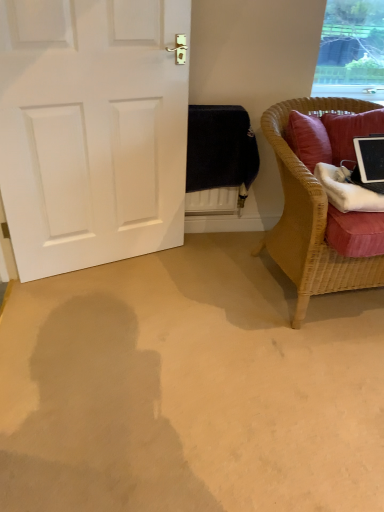
This screenshot has height=512, width=384. I want to click on woven wicker chair at right, so click(x=310, y=217).

The width and height of the screenshot is (384, 512). Describe the element at coordinates (91, 130) in the screenshot. I see `white matte door at left` at that location.

What are the coordinates of `transparent glass window at upper right` in the screenshot? It's located at (351, 51).

How distant is transparent glass window at upper right from black glossy tablet at right?

transparent glass window at upper right and black glossy tablet at right are 3.73 feet apart.

Would you say transparent glass window at upper right is to the left or to the right of black glossy tablet at right in the picture?

Based on their positions, transparent glass window at upper right is located to the right of black glossy tablet at right.

Considering their positions, is transparent glass window at upper right located in front of or behind black glossy tablet at right?

In the image, transparent glass window at upper right appears behind black glossy tablet at right.

From the image's perspective, is transparent glass window at upper right above black glossy tablet at right?

Indeed, from the image's perspective, transparent glass window at upper right is shown above black glossy tablet at right.

Is woven wicker chair at right not within black glossy tablet at right?

Yes, woven wicker chair at right is located beyond the bounds of black glossy tablet at right.

Is woven wicker chair at right positioned behind black glossy tablet at right?

No, it is not.

Who is taller, woven wicker chair at right or black glossy tablet at right?

With more height is woven wicker chair at right.

Between woven wicker chair at right and black glossy tablet at right, which one appears on the right side from the viewer's perspective?

black glossy tablet at right is more to the right.

From the image's perspective, does woven wicker chair at right appear higher than white matte door at left?

Incorrect, from the image's perspective, woven wicker chair at right is lower than white matte door at left.

In the scene shown: Is woven wicker chair at right inside or outside of white matte door at left?

woven wicker chair at right exists outside the volume of white matte door at left.

From a real-world perspective, relative to white matte door at left, is woven wicker chair at right vertically above or below?

woven wicker chair at right is below white matte door at left.

Is woven wicker chair at right further to camera compared to white matte door at left?

No, it is not.

Considering the relative positions of white matte door at left and black glossy tablet at right in the image provided, is white matte door at left to the right of black glossy tablet at right from the viewer's perspective?

Incorrect, white matte door at left is not on the right side of black glossy tablet at right.

Is point (142, 234) positioned in front of point (377, 179)?

No, (142, 234) is further to viewer.

Is white matte door at left far away from black glossy tablet at right?

Absolutely, white matte door at left is distant from black glossy tablet at right.

Considering the relative sizes of white matte door at left and black glossy tablet at right in the image provided, is white matte door at left wider than black glossy tablet at right?

No.

From the image's perspective, is black glossy tablet at right located above or below transparent glass window at upper right?

Clearly, from the image's perspective, black glossy tablet at right is below transparent glass window at upper right.

Is point (363, 159) closer to camera compared to point (371, 41)?

Yes, point (363, 159) is closer to viewer.

Based on the photo, considering the relative sizes of black glossy tablet at right and transparent glass window at upper right in the image provided, is black glossy tablet at right thinner than transparent glass window at upper right?

Incorrect, the width of black glossy tablet at right is not less than that of transparent glass window at upper right.

Does black glossy tablet at right have a greater height compared to transparent glass window at upper right?

Incorrect, the height of black glossy tablet at right is not larger of that of transparent glass window at upper right.

Is white matte door at left positioned behind woven wicker chair at right?

Yes, the depth of white matte door at left is greater than that of woven wicker chair at right.

Considering the sizes of objects white matte door at left and woven wicker chair at right in the image provided, who is taller, white matte door at left or woven wicker chair at right?

white matte door at left is taller.

Does white matte door at left turn towards woven wicker chair at right?

No, white matte door at left is not turned towards woven wicker chair at right.

Considering the relative sizes of white matte door at left and woven wicker chair at right in the image provided, is white matte door at left thinner than woven wicker chair at right?

Indeed, white matte door at left has a lesser width compared to woven wicker chair at right.

Does point (374, 157) lie in front of point (314, 196)?

No, (374, 157) is further to viewer.

The width and height of the screenshot is (384, 512). In order to click on chair lying on the left of black glossy tablet at right in this screenshot , I will do [x=310, y=217].

Could you tell me if black glossy tablet at right is facing woven wicker chair at right?

Yes, black glossy tablet at right is turned towards woven wicker chair at right.

The image size is (384, 512). Identify the location of window above the black glossy tablet at right (from the image's perspective). (351, 51).

At what (x,y) coordinates should I click in order to perform the action: click on laptop above the woven wicker chair at right (from a real-world perspective). Please return your answer as a coordinate pair (x, y). The width and height of the screenshot is (384, 512). Looking at the image, I should click on (369, 163).

Based on their spatial positions, is woven wicker chair at right or black glossy tablet at right closer to white matte door at left?

woven wicker chair at right lies closer to white matte door at left than the other object.

Looking at this image, based on their spatial positions, is white matte door at left or black glossy tablet at right closer to woven wicker chair at right?

black glossy tablet at right.

Estimate the real-world distances between objects in this image. Which object is closer to transparent glass window at upper right, white matte door at left or woven wicker chair at right?

woven wicker chair at right lies closer to transparent glass window at upper right than the other object.

Looking at the image, which one is located further to transparent glass window at upper right, woven wicker chair at right or white matte door at left?

white matte door at left lies further to transparent glass window at upper right than the other object.

Looking at this image, considering their positions, is woven wicker chair at right positioned closer to black glossy tablet at right than transparent glass window at upper right?

Among the two, woven wicker chair at right is located nearer to black glossy tablet at right.

When comparing their distances from black glossy tablet at right, does white matte door at left or woven wicker chair at right seem closer?

woven wicker chair at right is positioned closer to the anchor black glossy tablet at right.

Based on their spatial positions, is woven wicker chair at right or transparent glass window at upper right closer to white matte door at left?

woven wicker chair at right is closer to white matte door at left.

Considering their positions, is black glossy tablet at right positioned further to transparent glass window at upper right than white matte door at left?

Among the two, white matte door at left is located further to transparent glass window at upper right.

Locate an element on the screen. chair between white matte door at left and black glossy tablet at right is located at coordinates 310,217.

Identify the location of chair located between white matte door at left and transparent glass window at upper right in the left-right direction. Image resolution: width=384 pixels, height=512 pixels. (310, 217).

The image size is (384, 512). I want to click on laptop between white matte door at left and transparent glass window at upper right in the horizontal direction, so click(369, 163).

In order to click on laptop located between woven wicker chair at right and transparent glass window at upper right in the depth direction in this screenshot , I will do `click(369, 163)`.